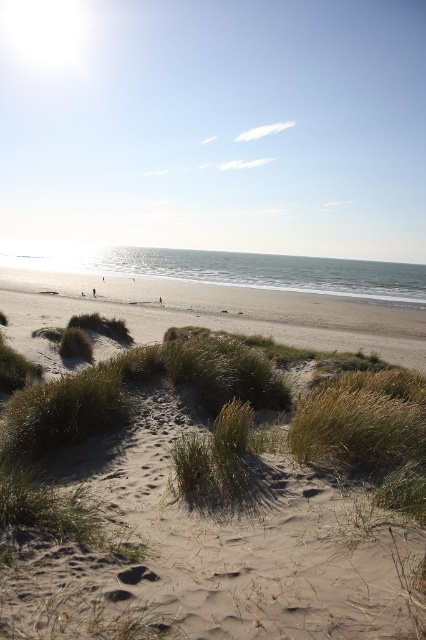
Question: Is sandy beige dunes at center closer to the viewer compared to brown sand at lower center?

Choices:
 (A) no
 (B) yes

Answer: (B)

Question: Is the position of sandy beige dunes at center more distant than that of brown sand at lower center?

Choices:
 (A) yes
 (B) no

Answer: (B)

Question: Considering the relative positions of sandy beige dunes at center and brown sand at lower center in the image provided, where is sandy beige dunes at center located with respect to brown sand at lower center?

Choices:
 (A) left
 (B) right

Answer: (B)

Question: Which point is farther from the camera taking this photo?

Choices:
 (A) (230, 568)
 (B) (178, 312)

Answer: (B)

Question: Which point is closer to the camera taking this photo?

Choices:
 (A) (218, 288)
 (B) (330, 516)

Answer: (B)